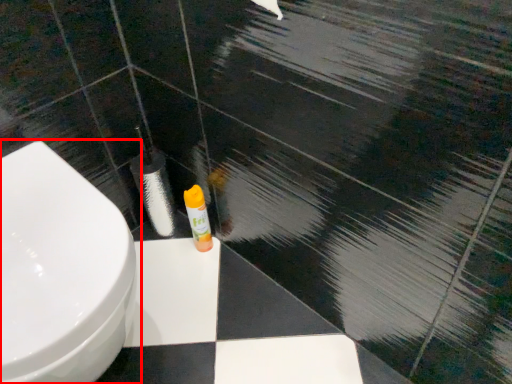
Question: From the image's perspective, where is toilet (annotated by the red box) located in relation to toiletry in the image?

Choices:
 (A) above
 (B) below

Answer: (B)